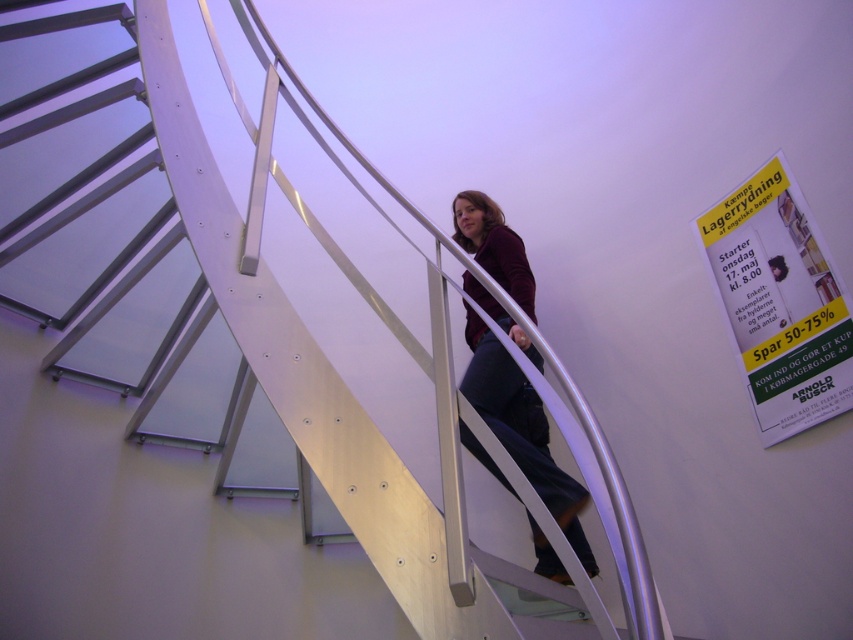
You are an interior designer assessing the color coordination in the scene. The yellow paper poster at upper right and the matte maroon sweater at center are both visible. Which object has a smaller size?

The yellow paper poster at upper right has a smaller size compared to the matte maroon sweater at center.